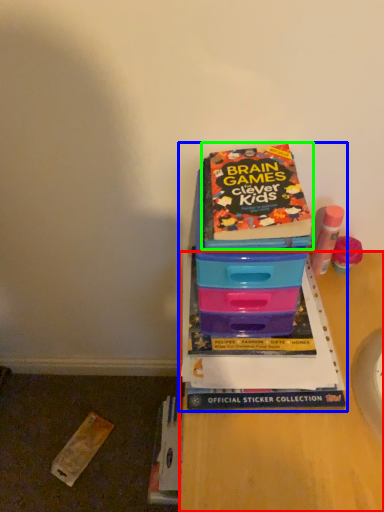
Question: Based on their relative distances, which object is farther from desk (highlighted by a red box)? Choose from book (highlighted by a blue box) and book (highlighted by a green box).

Choices:
 (A) book
 (B) book

Answer: (B)